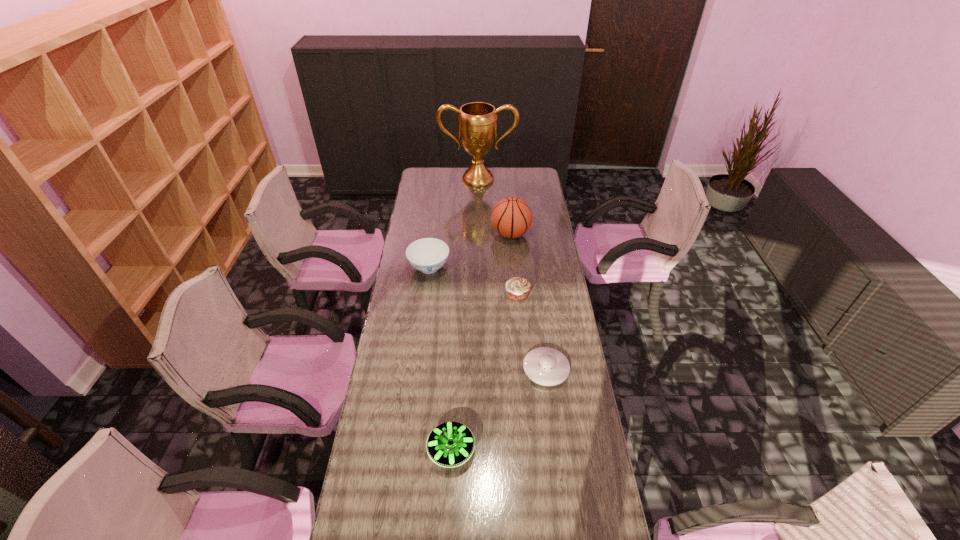
This screenshot has width=960, height=540. In order to click on vacant space located on the surface of the tallest object with symbols in this screenshot , I will do `click(478, 218)`.

This screenshot has height=540, width=960. What are the coordinates of `free space located 0.400m on the side where the inflation valve is located` in the screenshot? It's located at (412, 234).

This screenshot has height=540, width=960. In order to click on free space located on the side where the inflation valve is located in this screenshot , I will do `click(421, 234)`.

This screenshot has width=960, height=540. I want to click on free space located 0.240m on the side where the inflation valve is located, so click(x=444, y=234).

Locate an element on the screen. This screenshot has height=540, width=960. vacant region located 0.170m on the back of the third farthest object is located at coordinates (434, 233).

Where is `free space located 0.170m on the back of the muffin`? The height and width of the screenshot is (540, 960). free space located 0.170m on the back of the muffin is located at coordinates (515, 261).

The image size is (960, 540). Identify the location of vacant space located on the back of the taller saucer. (454, 396).

Where is `free space located on the back of the shorter saucer`? The height and width of the screenshot is (540, 960). free space located on the back of the shorter saucer is located at coordinates (538, 307).

Locate an element on the screen. This screenshot has width=960, height=540. object that is at the far edge is located at coordinates (477, 124).

Where is `trophy cup at the left edge`? The width and height of the screenshot is (960, 540). trophy cup at the left edge is located at coordinates (477, 124).